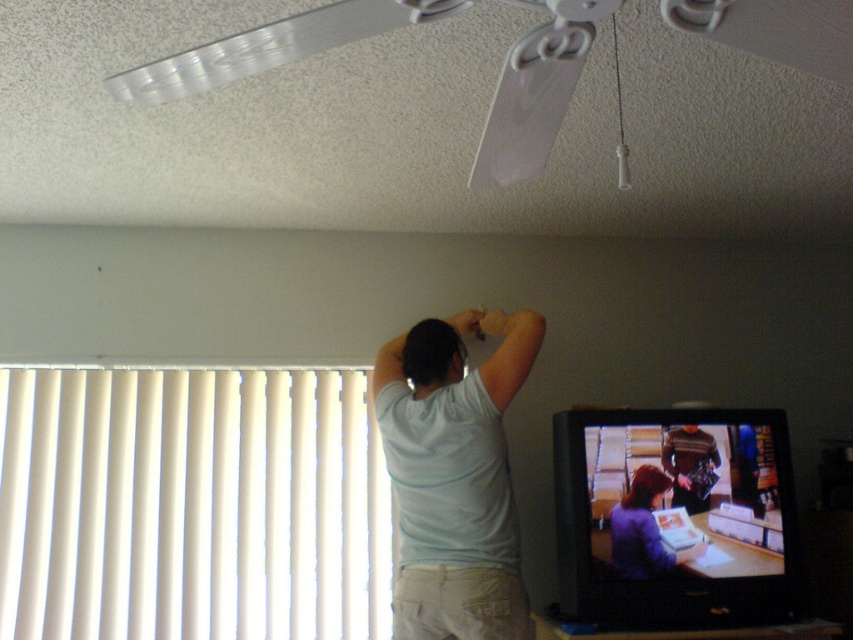
Question: From the image, what is the correct spatial relationship of white vertical blinds at left in relation to striped sweater at upper right?

Choices:
 (A) right
 (B) left

Answer: (B)

Question: Which object appears closest to the camera in this image?

Choices:
 (A) matte black television at lower right
 (B) white plastic fan at upper center
 (C) white cotton shirt at center

Answer: (B)

Question: Does matte black television at lower right appear under purple matte shirt at center?

Choices:
 (A) no
 (B) yes

Answer: (A)

Question: Does white cotton shirt at center have a larger size compared to white plastic fan at upper center?

Choices:
 (A) no
 (B) yes

Answer: (B)

Question: Which object appears farthest from the camera in this image?

Choices:
 (A) striped sweater at upper right
 (B) white plastic fan at upper center
 (C) white vertical blinds at left

Answer: (C)

Question: Which point is farther to the camera?

Choices:
 (A) white vertical blinds at left
 (B) white plastic fan at upper center
 (C) purple matte shirt at center
 (D) striped sweater at upper right

Answer: (A)